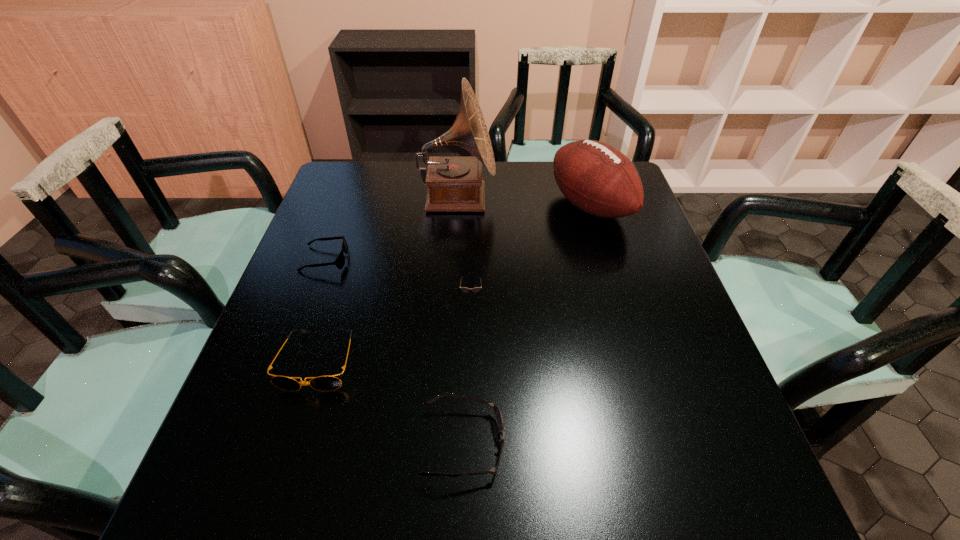
This screenshot has width=960, height=540. In order to click on free region located in front of the lenses of the fourth farthest object in this screenshot , I will do `click(468, 458)`.

The height and width of the screenshot is (540, 960). In order to click on blank space located on the lenses of the second nearest object in this screenshot , I will do 269,525.

Identify the location of blank space located 0.140m on the lenses of the nearest object. The image size is (960, 540). point(583,443).

Find the location of a particular element. Image resolution: width=960 pixels, height=540 pixels. vacant space located on the front-facing side of the shortest sunglasses is located at coordinates (453, 260).

Where is `phonograph record at the far edge`? Image resolution: width=960 pixels, height=540 pixels. phonograph record at the far edge is located at coordinates (454, 183).

Identify the location of football (American) present at the far edge. (595, 177).

Where is `object at the near edge`? This screenshot has width=960, height=540. object at the near edge is located at coordinates (498, 415).

This screenshot has height=540, width=960. Find the location of `object that is at the right edge`. object that is at the right edge is located at coordinates (595, 177).

Find the location of a particular element. object at the far right corner is located at coordinates (595, 177).

The width and height of the screenshot is (960, 540). I want to click on vacant area at the far edge of the desktop, so click(533, 181).